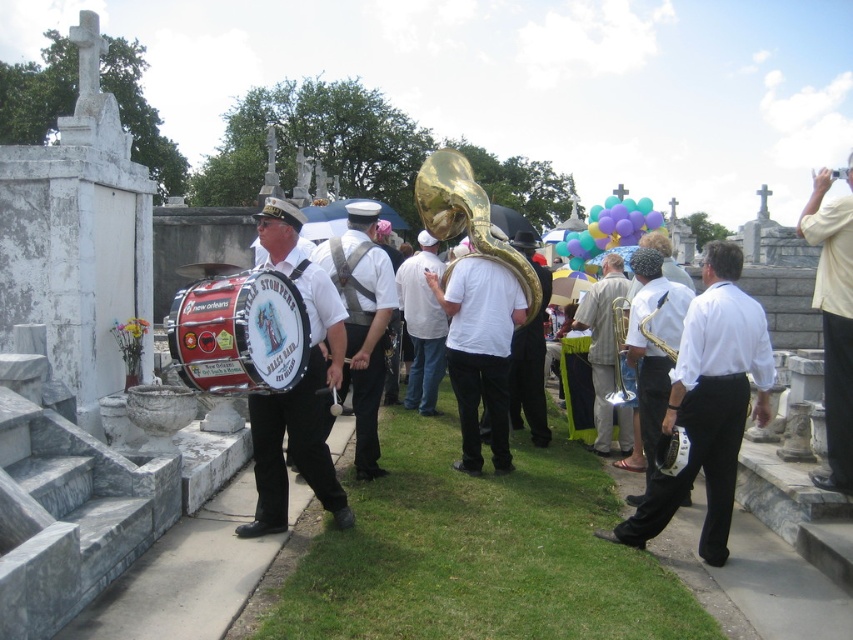
Question: Does white matte drum at center come behind gold brass trumpet at center?

Choices:
 (A) no
 (B) yes

Answer: (A)

Question: Does matte black drum at center appear under red drum at center?

Choices:
 (A) no
 (B) yes

Answer: (B)

Question: Does matte black drum at center have a smaller size compared to red drum at center?

Choices:
 (A) yes
 (B) no

Answer: (B)

Question: Among these points, which one is farthest from the camera?

Choices:
 (A) (643, 355)
 (B) (276, 228)
 (C) (837, 365)

Answer: (A)

Question: Which point is closer to the camera?

Choices:
 (A) white matte tuba at center
 (B) white matte shirt at center
 (C) white matte drum at center
 (D) matte white saxophone at center

Answer: (C)

Question: Which object appears farthest from the camera in this image?

Choices:
 (A) white matte tuba at center
 (B) matte white saxophone at center
 (C) white matte drum at center
 (D) yellow shirt at upper right

Answer: (A)